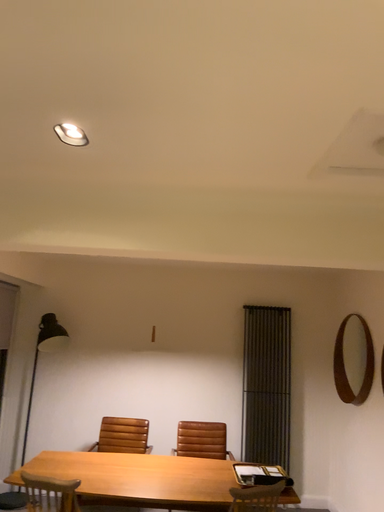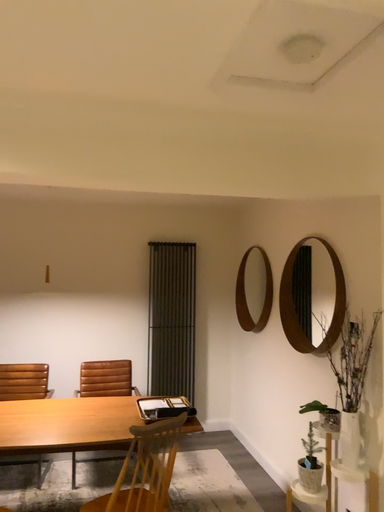
Question: How did the camera likely rotate when shooting the video?

Choices:
 (A) rotated upward
 (B) rotated downward

Answer: (B)